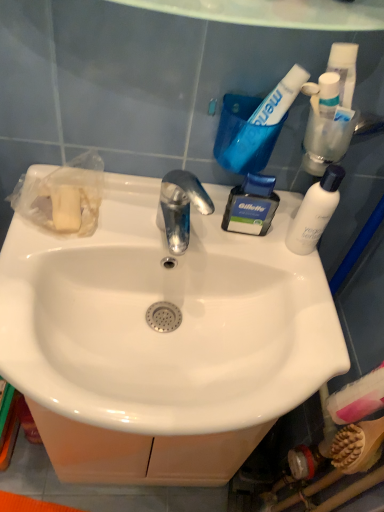
Image resolution: width=384 pixels, height=512 pixels. Identify the location of blank space to the left of white matte bottle at upper right. (211, 242).